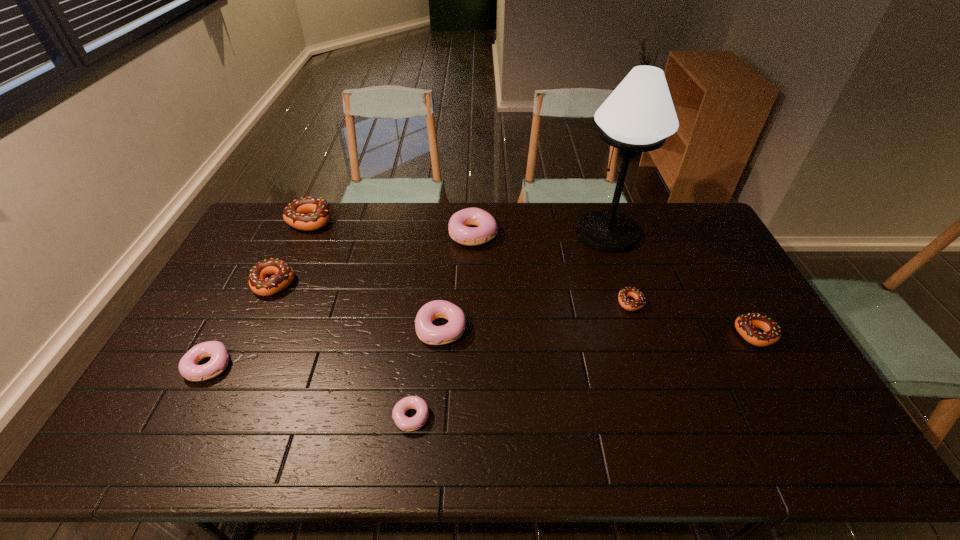
Locate an element on the screen. the tallest object is located at coordinates (639, 114).

Image resolution: width=960 pixels, height=540 pixels. I want to click on table lamp, so click(639, 114).

Image resolution: width=960 pixels, height=540 pixels. Identify the location of the biggest brown doughnut. (296, 215).

What are the coordinates of `the farthest purple doughnut` in the screenshot? It's located at (487, 229).

The image size is (960, 540). What are the coordinates of `the second biggest brown doughnut` in the screenshot? It's located at (283, 276).

Image resolution: width=960 pixels, height=540 pixels. Find the location of `the third smallest purple doughnut`. the third smallest purple doughnut is located at coordinates (428, 333).

Locate an element on the screen. This screenshot has width=960, height=540. the rightmost brown doughnut is located at coordinates (745, 324).

At what (x,y) coordinates should I click in order to perform the action: click on the second smallest brown doughnut. Please return your answer as a coordinate pair (x, y). Image resolution: width=960 pixels, height=540 pixels. Looking at the image, I should click on (745, 324).

I want to click on the third biggest purple doughnut, so click(x=188, y=368).

I want to click on the second doughnut from right to left, so click(x=631, y=305).